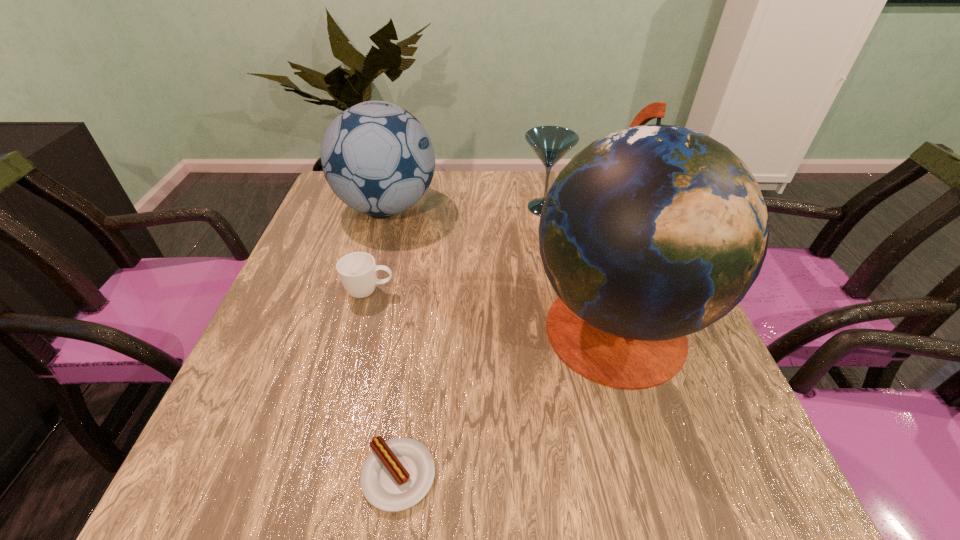
At what (x,y) coordinates should I click in order to perform the action: click on vacant point located 0.050m on the back of the martini. Please return your answer as a coordinate pair (x, y). This screenshot has width=960, height=540. Looking at the image, I should click on (540, 186).

This screenshot has height=540, width=960. In order to click on free space located with the handle on the side of the cup in this screenshot , I will do `click(472, 292)`.

You are a GUI agent. You are given a task and a screenshot of the screen. Output one action in this format:
    pyautogui.click(x=<x>, y=<y>)
    Task: Click on the vacant space situated on the back of the sausage
    Image resolution: width=960 pixels, height=540 pixels.
    Given the screenshot: What is the action you would take?
    pyautogui.click(x=419, y=329)

Find the location of a particular element. soccer ball that is at the far edge is located at coordinates (377, 158).

Identify the location of martini that is at the far edge. (550, 143).

The height and width of the screenshot is (540, 960). What are the coordinates of `object positioned at the near edge` in the screenshot? It's located at (398, 473).

Locate an element on the screen. The image size is (960, 540). soccer ball at the left edge is located at coordinates (377, 158).

Locate an element on the screen. cup present at the left edge is located at coordinates (357, 271).

Where is `object at the right edge`? The height and width of the screenshot is (540, 960). object at the right edge is located at coordinates (654, 232).

Identify the location of object that is at the far left corner. This screenshot has width=960, height=540. (377, 158).